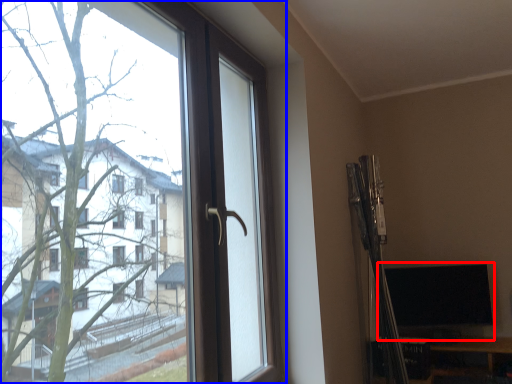
Question: Among these objects, which one is farthest to the camera, computer monitor (highlighted by a red box) or window (highlighted by a blue box)?

Choices:
 (A) computer monitor
 (B) window

Answer: (A)